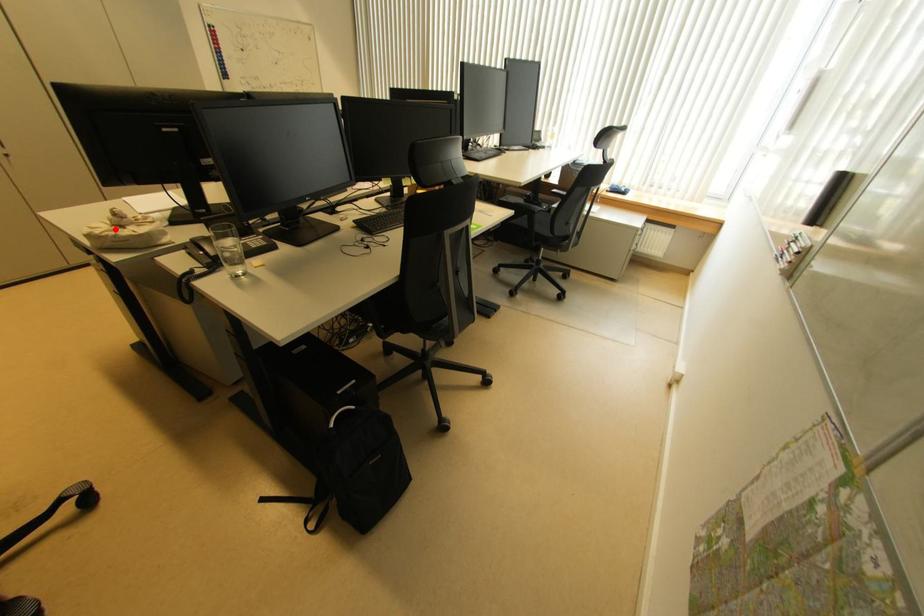
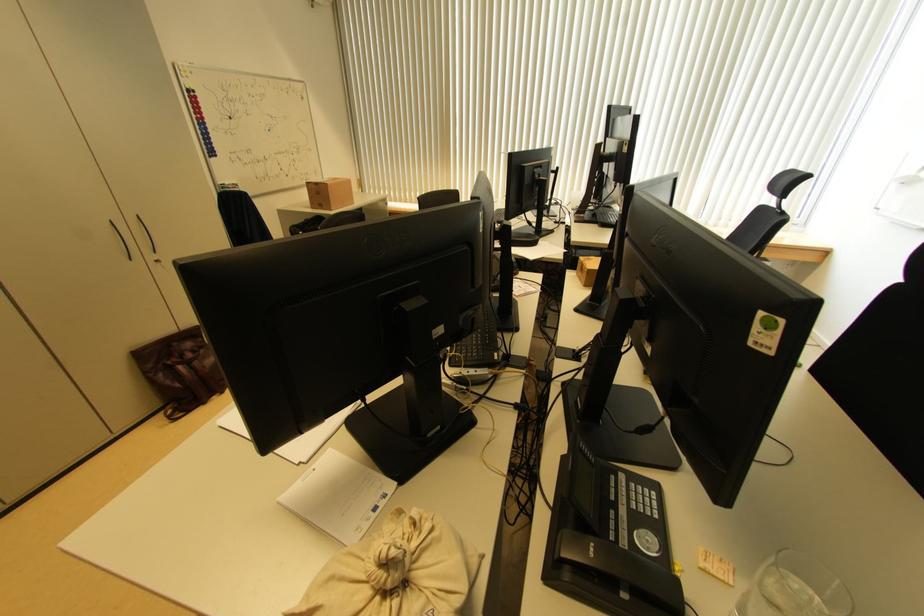
In the second image, find the point that corresponds to the highlighted location in the first image.

(387, 597)